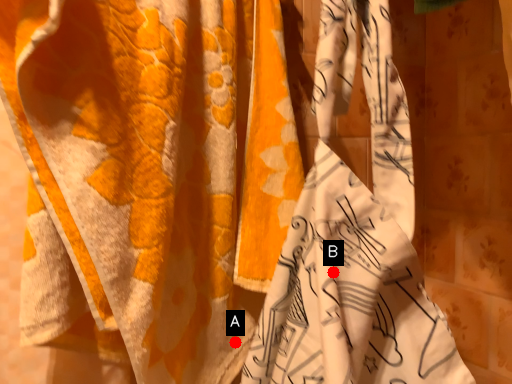
Question: Two points are circled on the image, labeled by A and B beside each circle. Which of the following is the farthest from the observer?

Choices:
 (A) A is further
 (B) B is further

Answer: (A)